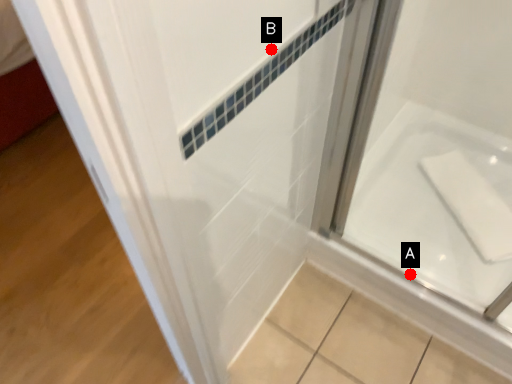
Question: Two points are circled on the image, labeled by A and B beside each circle. Which of the following is the closest to the observer?

Choices:
 (A) A is closer
 (B) B is closer

Answer: (B)